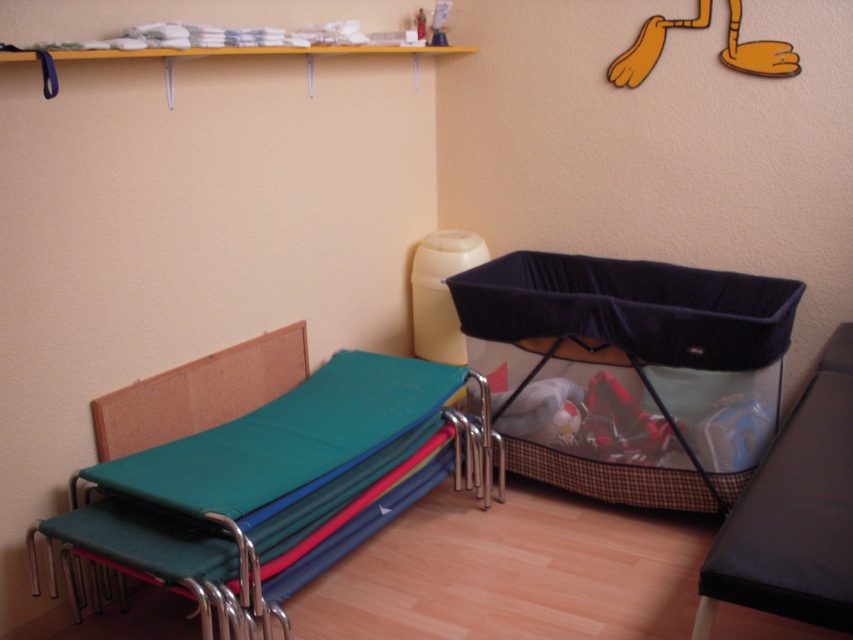
You are standing in the room corner and want to sit down. Where is the black fabric chair at lower right located?

The black fabric chair at lower right is located at point (793, 513).

You are organizing a nursery and need to place the velvet black crib at center and the teal fabric chair at lower left. According to the scene, where should the teal fabric chair be positioned relative to the crib?

The teal fabric chair at lower left should be positioned to the left of the velvet black crib at center since the crib is to the right of the chair.